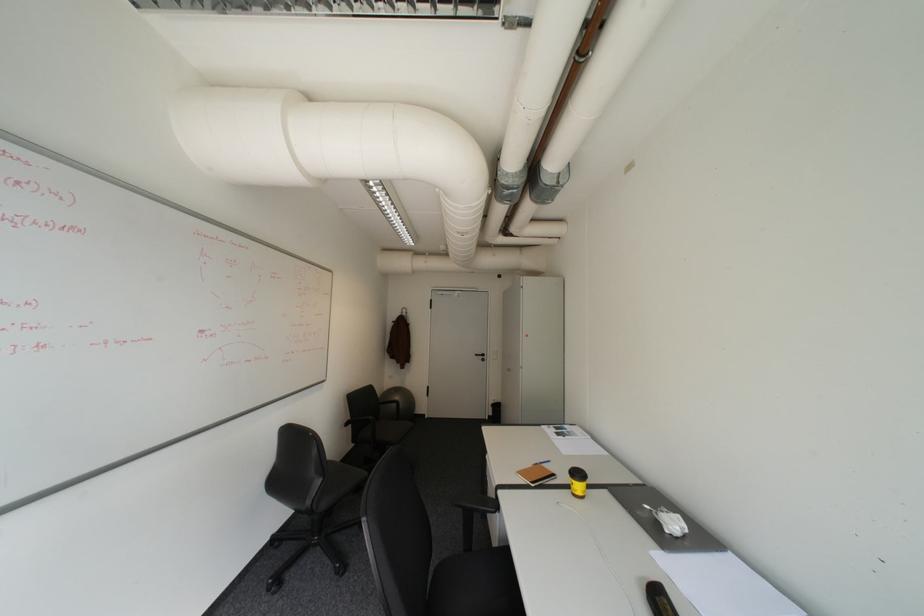
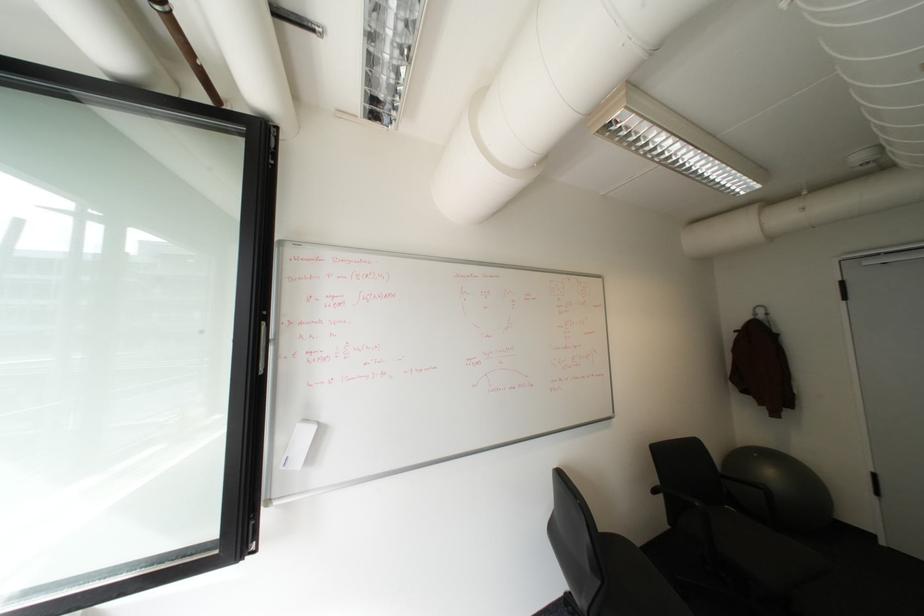
Question: The camera is either moving clockwise (left) or counter-clockwise (right) around the object. The first image is from the beginning of the video and the second image is from the end. Is the camera moving left or right when shooting the video?

Choices:
 (A) Left
 (B) Right

Answer: (B)